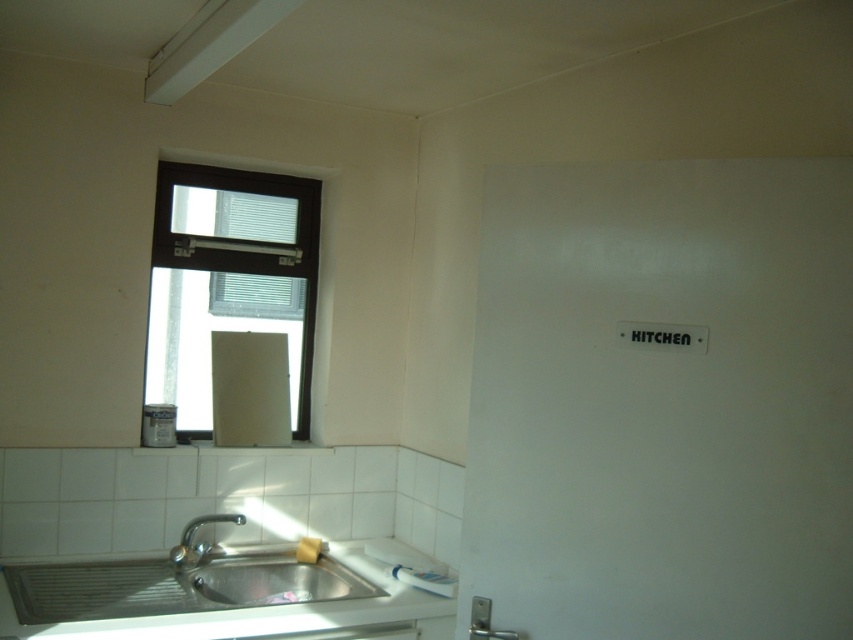
Which is behind, point (228, 170) or point (189, 548)?

The point (228, 170) is more distant.

Can you confirm if brown matte window at upper left is positioned below satin nickel faucet at sink left?

No.

Does point (289, 308) come in front of point (193, 518)?

No.

In order to click on brown matte window at upper left in this screenshot , I will do `click(228, 280)`.

Consider the image. Is brown matte window at upper left bigger than white glossy countertop at lower left?

No.

Between point (225, 212) and point (408, 620), which one is positioned behind?

The point (225, 212) is more distant.

Identify the location of brown matte window at upper left. (228, 280).

Can you confirm if white glossy countertop at lower left is shorter than satin nickel faucet at sink left?

No.

Does white glossy countertop at lower left have a lesser width compared to satin nickel faucet at sink left?

No, white glossy countertop at lower left is not thinner than satin nickel faucet at sink left.

Does point (4, 609) come behind point (198, 548)?

No.

The height and width of the screenshot is (640, 853). In order to click on white glossy countertop at lower left in this screenshot , I will do `click(215, 598)`.